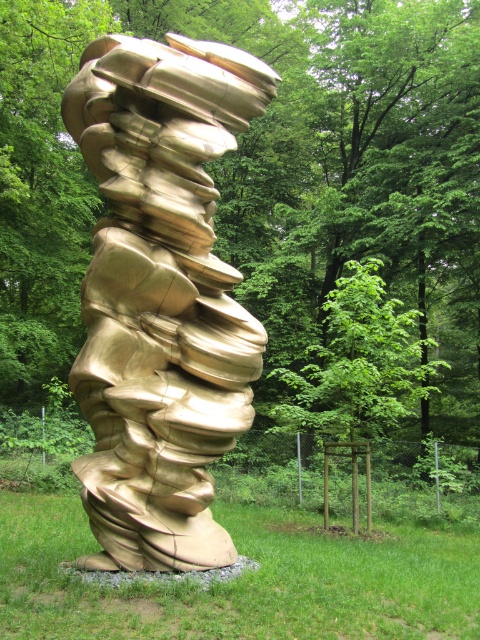
Question: Which point appears farthest from the camera in this image?

Choices:
 (A) pyautogui.click(x=135, y=433)
 (B) pyautogui.click(x=327, y=161)
 (C) pyautogui.click(x=467, y=637)

Answer: (B)

Question: Is green leafy tree at center bigger than green grass at lower center?

Choices:
 (A) yes
 (B) no

Answer: (A)

Question: Considering the real-world distances, which object is farthest from the green leafy tree at center?

Choices:
 (A) green grass at lower center
 (B) gold metallic sculpture at center

Answer: (B)

Question: Which point is farther from the camera taking this photo?

Choices:
 (A) (244, 124)
 (B) (287, 608)
 (C) (340, 76)

Answer: (C)

Question: Does green leafy tree at center have a smaller size compared to green grass at lower center?

Choices:
 (A) yes
 (B) no

Answer: (B)

Question: Is gold metallic sculpture at center below green grass at lower center?

Choices:
 (A) no
 (B) yes

Answer: (A)